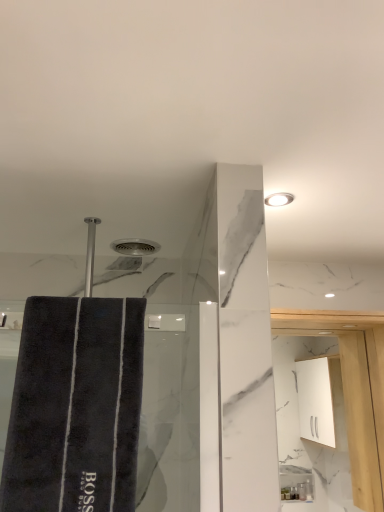
What do you see at coordinates (75, 406) in the screenshot? I see `dark gray plush bath towel at left` at bounding box center [75, 406].

Where is `white glossy cabinet at upper right`? The height and width of the screenshot is (512, 384). white glossy cabinet at upper right is located at coordinates (350, 377).

Image resolution: width=384 pixels, height=512 pixels. Identify the location of dark gray plush bath towel at left. (75, 406).

Which object is closer to the camera taking this photo, white glossy cabinet at upper right or dark gray plush bath towel at left?

Positioned in front is dark gray plush bath towel at left.

In terms of width, does white glossy cabinet at upper right look wider or thinner when compared to dark gray plush bath towel at left?

white glossy cabinet at upper right is thinner than dark gray plush bath towel at left.

Based on their positions, is white glossy cabinet at upper right located to the left or right of dark gray plush bath towel at left?

Clearly, white glossy cabinet at upper right is on the right of dark gray plush bath towel at left in the image.

Is white glossy cabinet at upper right touching dark gray plush bath towel at left?

No, white glossy cabinet at upper right is not making contact with dark gray plush bath towel at left.

Is white glossy cabinet at upper right surrounding white glossy light fixture at upper right?

That's incorrect, white glossy light fixture at upper right is not inside white glossy cabinet at upper right.

Is white glossy cabinet at upper right placed right next to white glossy light fixture at upper right?

No.

From the image's perspective, is white glossy cabinet at upper right positioned above or below white glossy light fixture at upper right?

Clearly, from the image's perspective, white glossy cabinet at upper right is below white glossy light fixture at upper right.

From a real-world perspective, between white glossy cabinet at upper right and white glossy light fixture at upper right, who is vertically lower?

white glossy cabinet at upper right, from a real-world perspective.

Considering the sizes of dark gray plush bath towel at left and white glossy cabinet at upper right in the image, is dark gray plush bath towel at left bigger or smaller than white glossy cabinet at upper right?

Clearly, dark gray plush bath towel at left is larger in size than white glossy cabinet at upper right.

Is dark gray plush bath towel at left closer to camera compared to white glossy cabinet at upper right?

Yes, dark gray plush bath towel at left is in front of white glossy cabinet at upper right.

Locate an element on the screen. bath towel located on the left of white glossy cabinet at upper right is located at coordinates (75, 406).

Is dark gray plush bath towel at left located outside white glossy cabinet at upper right?

Absolutely, dark gray plush bath towel at left is external to white glossy cabinet at upper right.

Is white glossy light fixture at upper right not near white glossy cabinet at upper right?

That's not correct — white glossy light fixture at upper right is a little close to white glossy cabinet at upper right.

From a real-world perspective, relative to white glossy cabinet at upper right, is white glossy light fixture at upper right vertically above or below?

From a real-world perspective, white glossy light fixture at upper right is physically above white glossy cabinet at upper right.

Is white glossy light fixture at upper right taller than white glossy cabinet at upper right?

No, white glossy light fixture at upper right is not taller than white glossy cabinet at upper right.

Is white glossy cabinet at upper right at the back of white glossy light fixture at upper right?

No, white glossy light fixture at upper right's orientation is not away from white glossy cabinet at upper right.

Can you confirm if dark gray plush bath towel at left is shorter than white glossy light fixture at upper right?

No.

In order to click on light fixture above the dark gray plush bath towel at left (from a real-world perspective) in this screenshot , I will do `click(279, 199)`.

Is the depth of dark gray plush bath towel at left less than that of white glossy light fixture at upper right?

Yes, dark gray plush bath towel at left is closer to the viewer.

From the image's perspective, does dark gray plush bath towel at left appear lower than white glossy light fixture at upper right?

Indeed, from the image's perspective, dark gray plush bath towel at left is shown beneath white glossy light fixture at upper right.

In the scene shown: From the image's perspective, which object appears higher, white glossy light fixture at upper right or dark gray plush bath towel at left?

white glossy light fixture at upper right appears higher in the image.

Is white glossy light fixture at upper right oriented towards dark gray plush bath towel at left?

No, white glossy light fixture at upper right is not aimed at dark gray plush bath towel at left.

In the scene shown: Considering the sizes of objects white glossy light fixture at upper right and dark gray plush bath towel at left in the image provided, who is shorter, white glossy light fixture at upper right or dark gray plush bath towel at left?

white glossy light fixture at upper right is shorter.

In order to click on bath towel on the left side of white glossy cabinet at upper right in this screenshot , I will do `click(75, 406)`.

Where is `light fixture above the white glossy cabinet at upper right (from the image's perspective)`? The height and width of the screenshot is (512, 384). light fixture above the white glossy cabinet at upper right (from the image's perspective) is located at coordinates (x=279, y=199).

Based on their spatial positions, is dark gray plush bath towel at left or white glossy light fixture at upper right further from white glossy cabinet at upper right?

dark gray plush bath towel at left is positioned further to the anchor white glossy cabinet at upper right.

When comparing their distances from dark gray plush bath towel at left, does white glossy light fixture at upper right or white glossy cabinet at upper right seem closer?

The object closer to dark gray plush bath towel at left is white glossy light fixture at upper right.

Estimate the real-world distances between objects in this image. Which object is further from dark gray plush bath towel at left, white glossy cabinet at upper right or white glossy light fixture at upper right?

white glossy cabinet at upper right is positioned further to the anchor dark gray plush bath towel at left.

When comparing their distances from white glossy cabinet at upper right, does white glossy light fixture at upper right or dark gray plush bath towel at left seem further?

dark gray plush bath towel at left.

Estimate the real-world distances between objects in this image. Which object is closer to white glossy light fixture at upper right, white glossy cabinet at upper right or dark gray plush bath towel at left?

dark gray plush bath towel at left lies closer to white glossy light fixture at upper right than the other object.

Looking at the image, which one is located closer to white glossy light fixture at upper right, dark gray plush bath towel at left or white glossy cabinet at upper right?

Among the two, dark gray plush bath towel at left is located nearer to white glossy light fixture at upper right.

Identify the location of light fixture between dark gray plush bath towel at left and white glossy cabinet at upper right from front to back. The height and width of the screenshot is (512, 384). (279, 199).